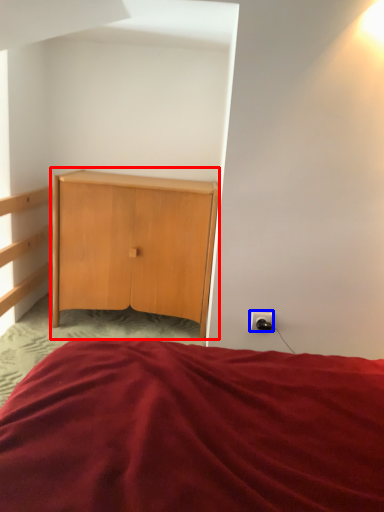
Question: Which object appears closest to the camera in this image, nightstand (highlighted by a red box) or electric outlet (highlighted by a blue box)?

Choices:
 (A) nightstand
 (B) electric outlet

Answer: (B)